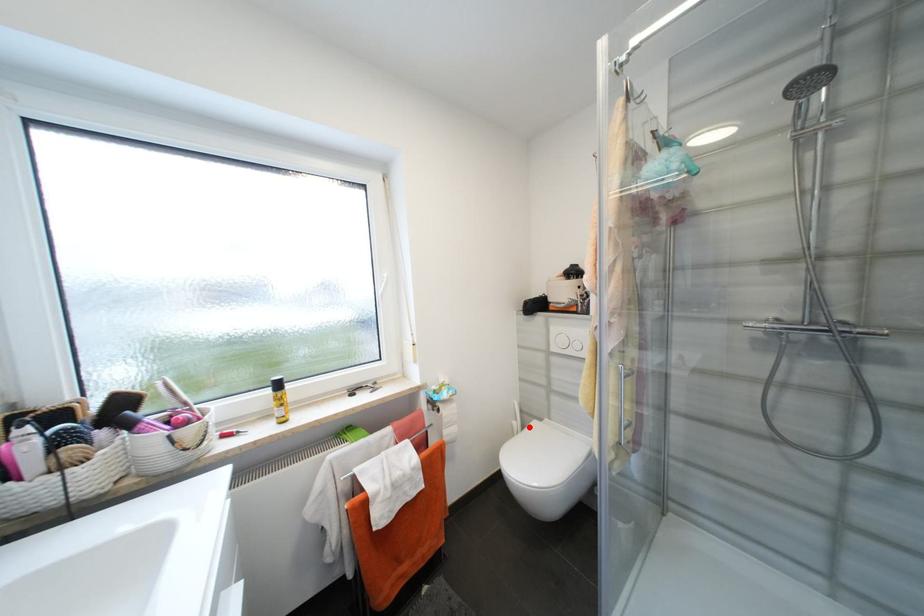
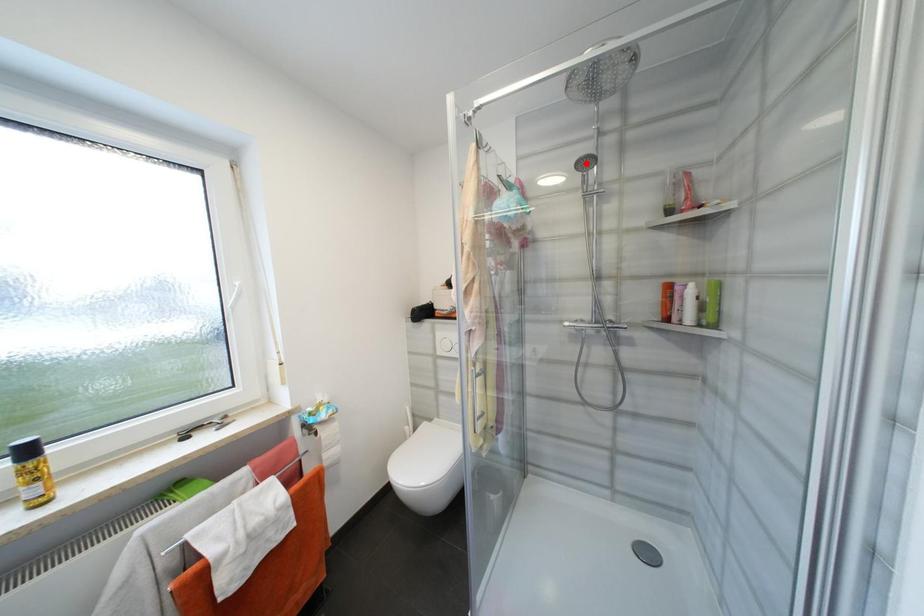
I am providing you with two images of the same scene from different viewpoints. A red point is marked on the first image and another point is marked on the second image. Do the highlighted points in image1 and image2 indicate the same real-world spot?

No